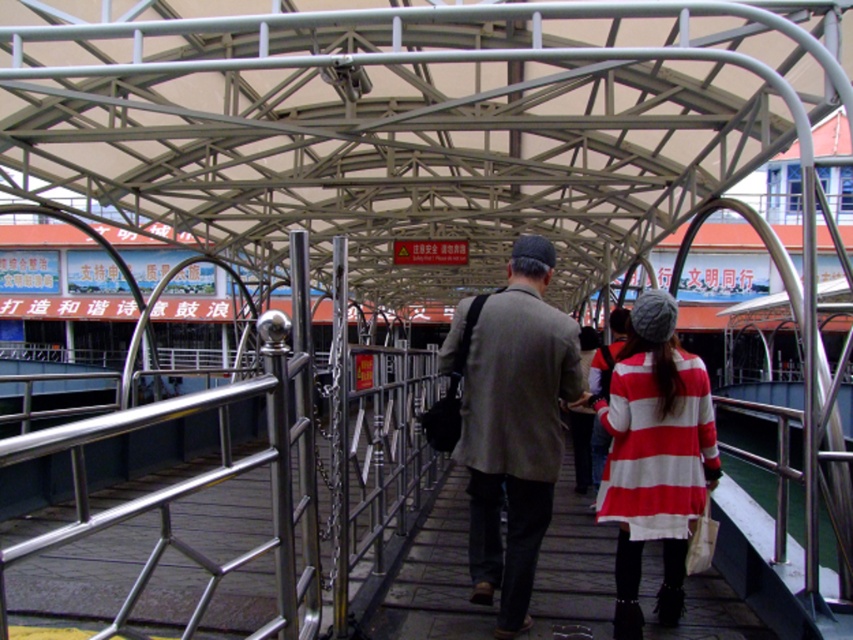
Which is in front, point (466, 365) or point (454, 504)?

Positioned in front is point (466, 365).

Who is more forward, (525, 449) or (612, 595)?

Point (525, 449) is in front.

What are the coordinates of `gray woolen jacket at center` in the screenshot? It's located at click(514, 428).

Does point (521, 550) come in front of point (717, 451)?

Yes, it is.

Does gray woolen jacket at center have a greater height compared to striped woolen coat at center?

Indeed, gray woolen jacket at center has a greater height compared to striped woolen coat at center.

Is point (500, 596) positioned in front of point (668, 545)?

Yes, point (500, 596) is in front of point (668, 545).

This screenshot has height=640, width=853. What are the coordinates of `gray woolen jacket at center` in the screenshot? It's located at (514, 428).

Is white striped dress at center to the left of striped woolen coat at center from the viewer's perspective?

Yes, white striped dress at center is to the left of striped woolen coat at center.

Which is more to the right, white striped dress at center or striped woolen coat at center?

striped woolen coat at center

Where is `white striped dress at center`? white striped dress at center is located at coordinates (428, 579).